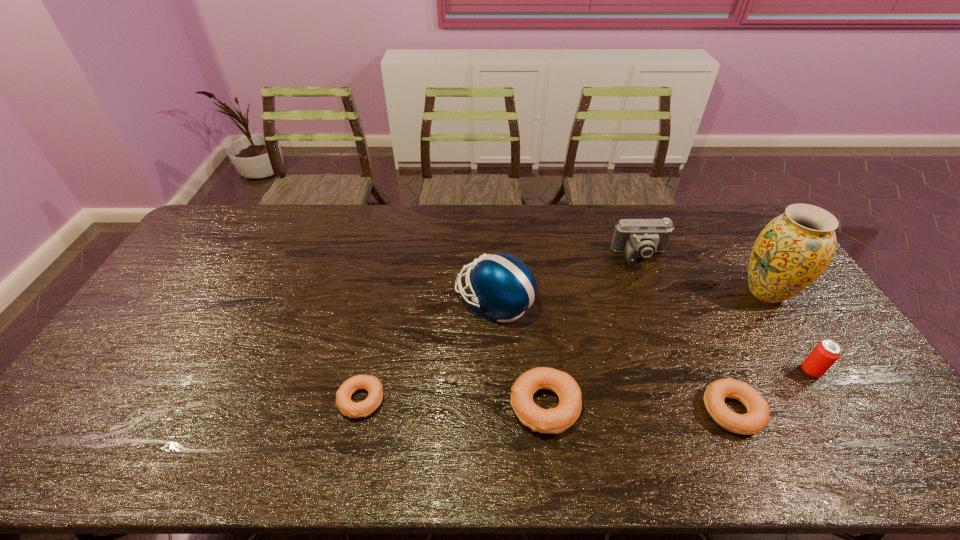
Locate an element on the screen. free space located 0.380m on the back of the leftmost bagel is located at coordinates (387, 281).

Find the location of a particular element. The height and width of the screenshot is (540, 960). vacant region located 0.100m on the back of the fifth tallest object is located at coordinates (538, 346).

The image size is (960, 540). In order to click on vacant space positioned on the back of the rightmost bagel in this screenshot , I will do `click(674, 281)`.

Where is `blank area located 0.050m at the front of the camera with an open lens cover`? This screenshot has width=960, height=540. blank area located 0.050m at the front of the camera with an open lens cover is located at coordinates [x=651, y=282].

I want to click on vacant space situated on the back of the beer can, so click(x=756, y=286).

Image resolution: width=960 pixels, height=540 pixels. I want to click on free spot located at the front of the sixth shortest object with the faceguard, so [x=422, y=302].

Locate an element on the screen. free spot located at the front of the sixth shortest object with the faceguard is located at coordinates (439, 302).

Where is `free spot located at the front of the sixth shortest object with the faceguard`? The image size is (960, 540). free spot located at the front of the sixth shortest object with the faceguard is located at coordinates (346, 302).

Identify the location of free location located 0.250m on the back of the vase. (724, 226).

You are a GUI agent. You are given a task and a screenshot of the screen. Output one action in this format:
    pyautogui.click(x=<x>, y=<y>)
    Task: Click on the beer can situated at the right edge
    The height and width of the screenshot is (540, 960).
    Given the screenshot: What is the action you would take?
    pyautogui.click(x=825, y=354)